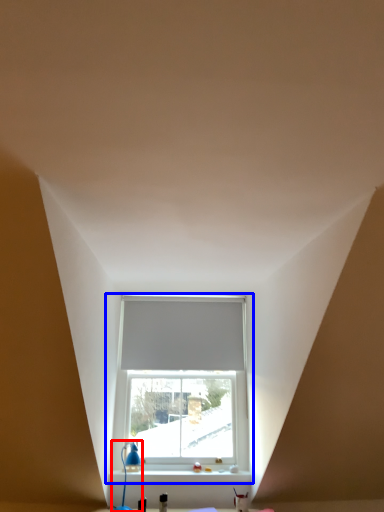
Question: Which point is further to the camera, table lamp (highlighted by a red box) or window (highlighted by a blue box)?

Choices:
 (A) table lamp
 (B) window

Answer: (B)